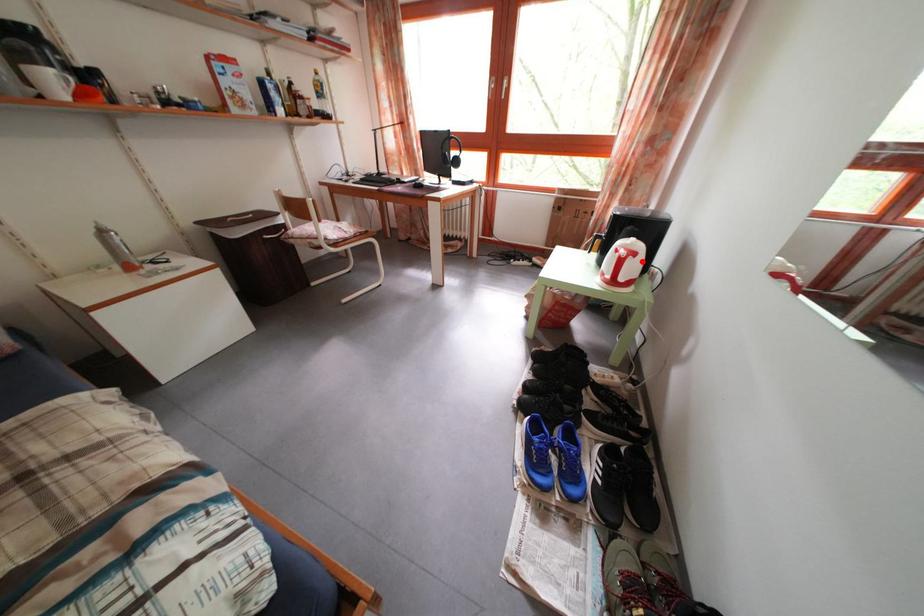
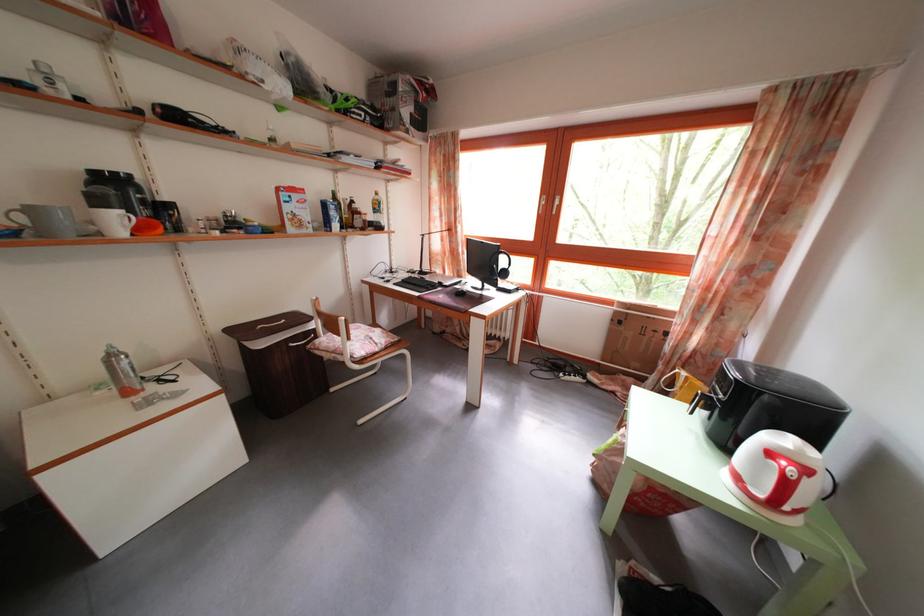
The point at the highlighted location is marked in the first image. Where is the corresponding point in the second image?

(812, 477)